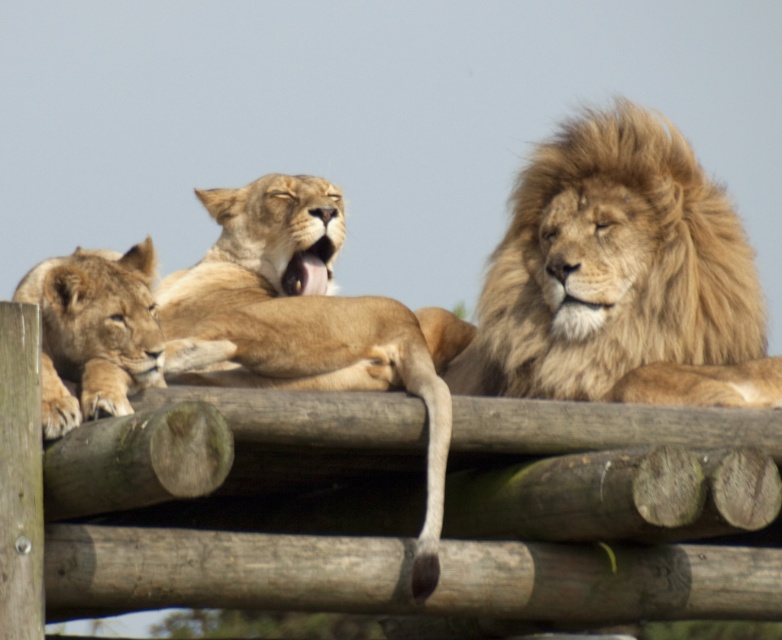
Question: Which object is farther from the camera taking this photo?

Choices:
 (A) golden fur lion at center
 (B) golden fur lion at right
 (C) golden fur lion cub at left

Answer: (B)

Question: Based on their relative distances, which object is nearer to the golden fur lion at center?

Choices:
 (A) golden fur lion at right
 (B) golden fur lion cub at left

Answer: (A)

Question: Estimate the real-world distances between objects in this image. Which object is closer to the golden fur lion cub at left?

Choices:
 (A) golden fur lion at right
 (B) golden fur lion at center

Answer: (B)

Question: Does golden fur lion at right appear under golden fur lion cub at left?

Choices:
 (A) no
 (B) yes

Answer: (B)

Question: Does golden fur lion at right have a larger size compared to golden fur lion at center?

Choices:
 (A) yes
 (B) no

Answer: (B)

Question: Does golden fur lion at right have a greater width compared to golden fur lion cub at left?

Choices:
 (A) no
 (B) yes

Answer: (B)